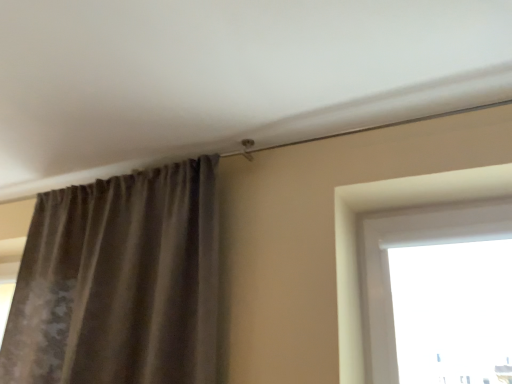
This screenshot has height=384, width=512. What do you see at coordinates (119, 282) in the screenshot? I see `brown textured curtain at upper left` at bounding box center [119, 282].

I want to click on brown textured curtain at upper left, so click(x=119, y=282).

Image resolution: width=512 pixels, height=384 pixels. I want to click on brown textured curtain at upper left, so click(x=119, y=282).